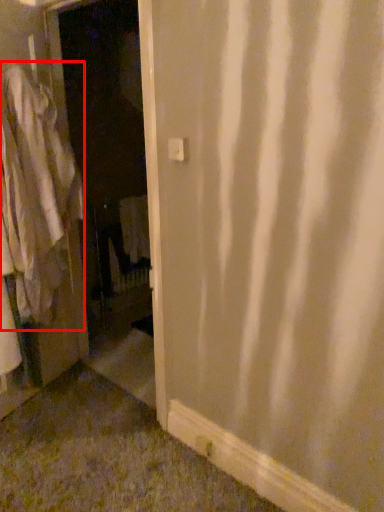
Question: From the image's perspective, where is clothing (annotated by the red box) located relative to screen door?

Choices:
 (A) below
 (B) above

Answer: (A)